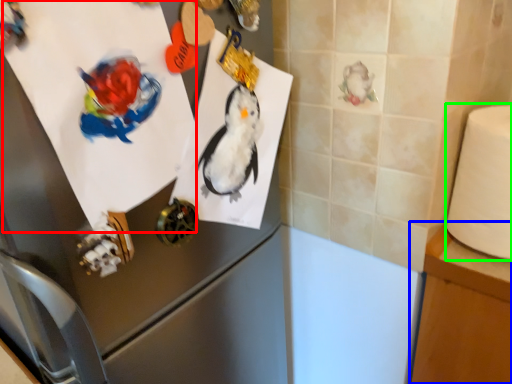
Question: Estimate the real-world distances between objects in this image. Which object is farther from paper (highlighted by a red box), table (highlighted by a blue box) or toilet paper (highlighted by a green box)?

Choices:
 (A) table
 (B) toilet paper

Answer: (A)